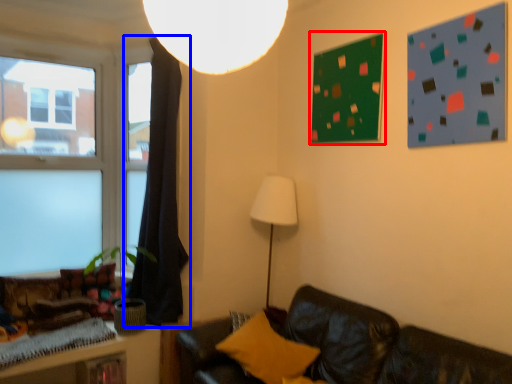
Question: Which of the following is the farthest to the observer, bulletin board (highlighted by a red box) or curtain (highlighted by a blue box)?

Choices:
 (A) bulletin board
 (B) curtain

Answer: (B)